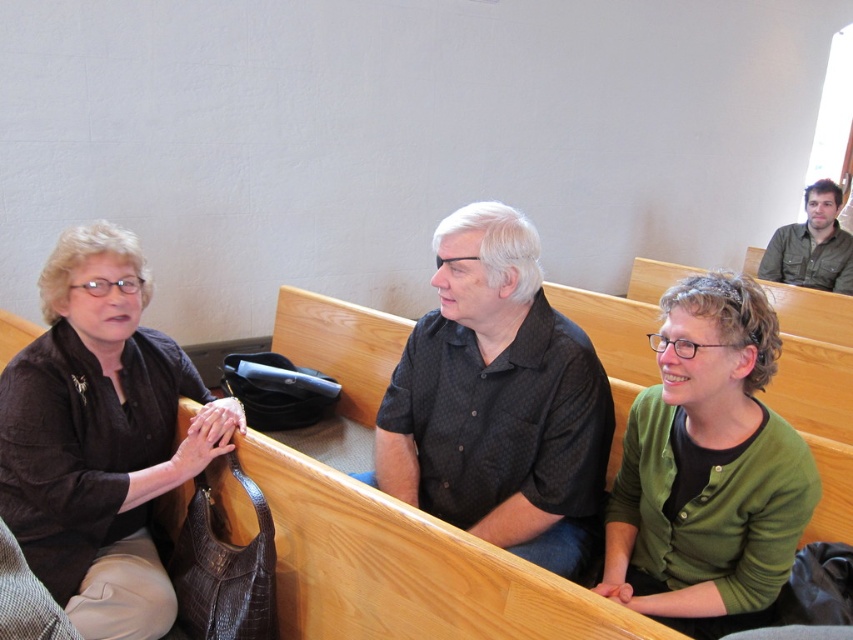
In the scene shown: Is black dotted shirt at center below green cardigan at center?

No, black dotted shirt at center is not below green cardigan at center.

Who is positioned more to the left, black dotted shirt at center or green cardigan at center?

black dotted shirt at center

Locate an element on the screen. The width and height of the screenshot is (853, 640). black dotted shirt at center is located at coordinates (497, 401).

You are a GUI agent. You are given a task and a screenshot of the screen. Output one action in this format:
    pyautogui.click(x=<x>, y=<y>)
    Task: Click on the black dotted shirt at center
    
    Given the screenshot: What is the action you would take?
    pyautogui.click(x=497, y=401)

Locate an element on the screen. matte brown purse at left is located at coordinates (100, 436).

Is matte brown purse at left bigger than green textured shirt at upper right?

Correct, matte brown purse at left is larger in size than green textured shirt at upper right.

Is point (83, 444) more distant than point (808, 209)?

No.

Where is `matte brown purse at left`? The image size is (853, 640). matte brown purse at left is located at coordinates pyautogui.click(x=100, y=436).

Who is positioned more to the left, green cardigan at center or green textured shirt at upper right?

Positioned to the left is green cardigan at center.

Which of these two, green cardigan at center or green textured shirt at upper right, stands shorter?

green textured shirt at upper right is shorter.

Between point (782, 440) and point (791, 243), which one is positioned in front?

Positioned in front is point (782, 440).

Where is `green cardigan at center`? Image resolution: width=853 pixels, height=640 pixels. green cardigan at center is located at coordinates (706, 468).